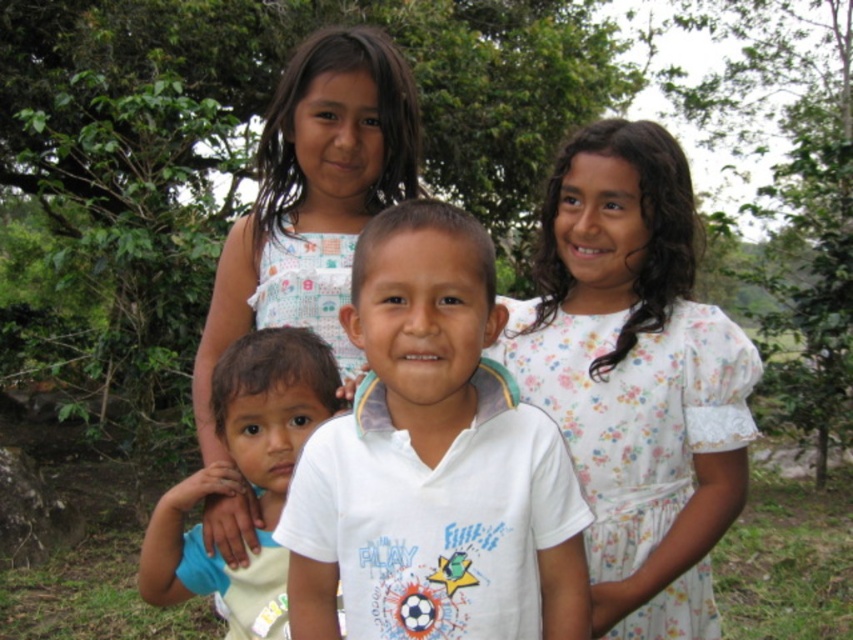
Which is more to the right, floral cotton dress at upper right or white floral dress at upper center?

Positioned to the right is floral cotton dress at upper right.

Can you confirm if floral cotton dress at upper right is bigger than white floral dress at upper center?

Incorrect, floral cotton dress at upper right is not larger than white floral dress at upper center.

Is point (693, 401) positioned before point (415, 132)?

Yes, it is.

Where is `floral cotton dress at upper right`? This screenshot has height=640, width=853. floral cotton dress at upper right is located at coordinates (636, 378).

Can you confirm if floral cotton dress at upper right is shorter than light brown skin at center?

No.

Who is more distant from viewer, (610,589) or (184,595)?

The point (184,595) is more distant.

You are a GUI agent. You are given a task and a screenshot of the screen. Output one action in this format:
    pyautogui.click(x=<x>, y=<y>)
    Task: Click on the floral cotton dress at upper right
    The width and height of the screenshot is (853, 640).
    Given the screenshot: What is the action you would take?
    pyautogui.click(x=636, y=378)

The image size is (853, 640). Describe the element at coordinates (433, 461) in the screenshot. I see `white cotton shirt at center` at that location.

Is white cotton shirt at center to the left of white floral dress at upper center from the viewer's perspective?

Incorrect, white cotton shirt at center is not on the left side of white floral dress at upper center.

The image size is (853, 640). Describe the element at coordinates (433, 461) in the screenshot. I see `white cotton shirt at center` at that location.

Image resolution: width=853 pixels, height=640 pixels. What are the coordinates of `white cotton shirt at center` in the screenshot? It's located at (433, 461).